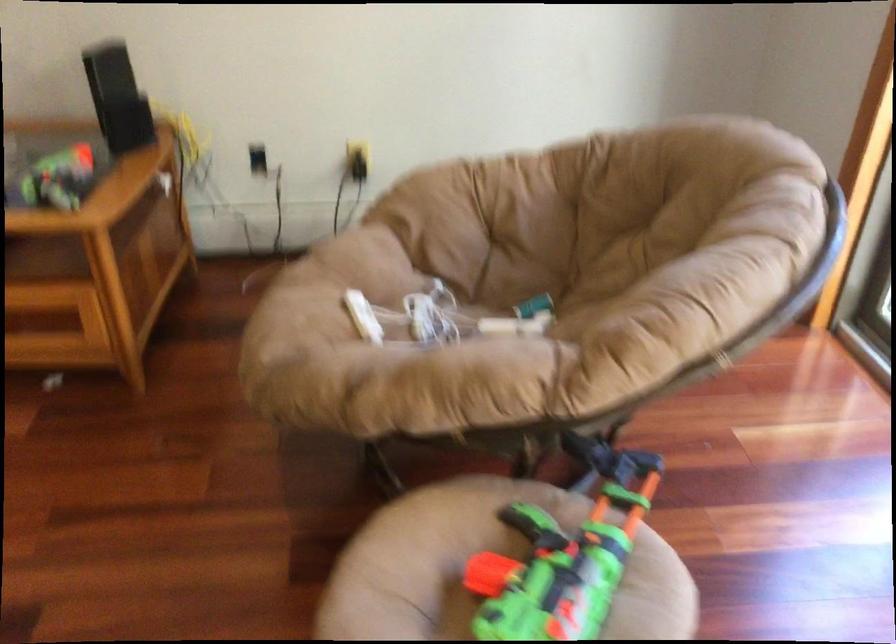
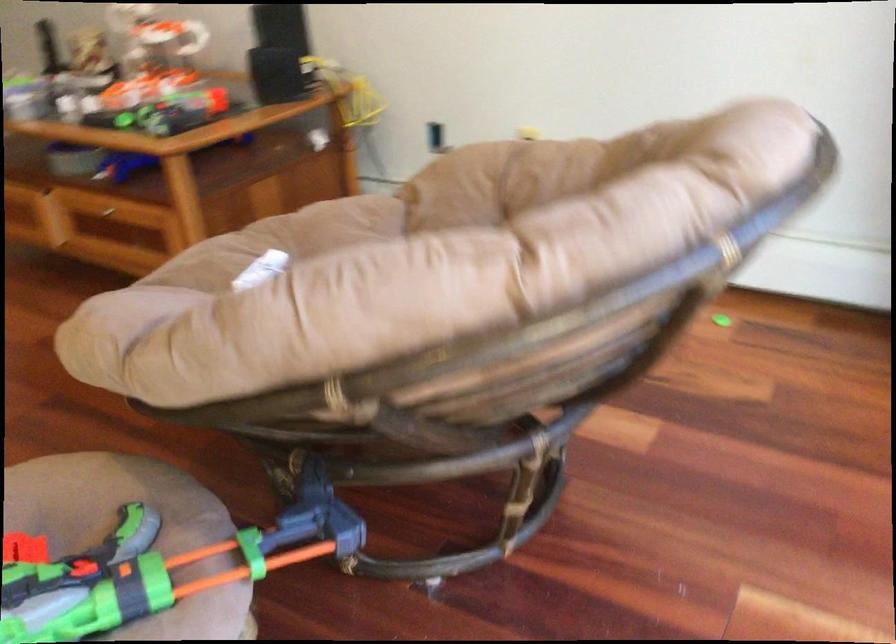
The point at (339, 281) is marked in the first image. Where is the corresponding point in the second image?

(281, 241)